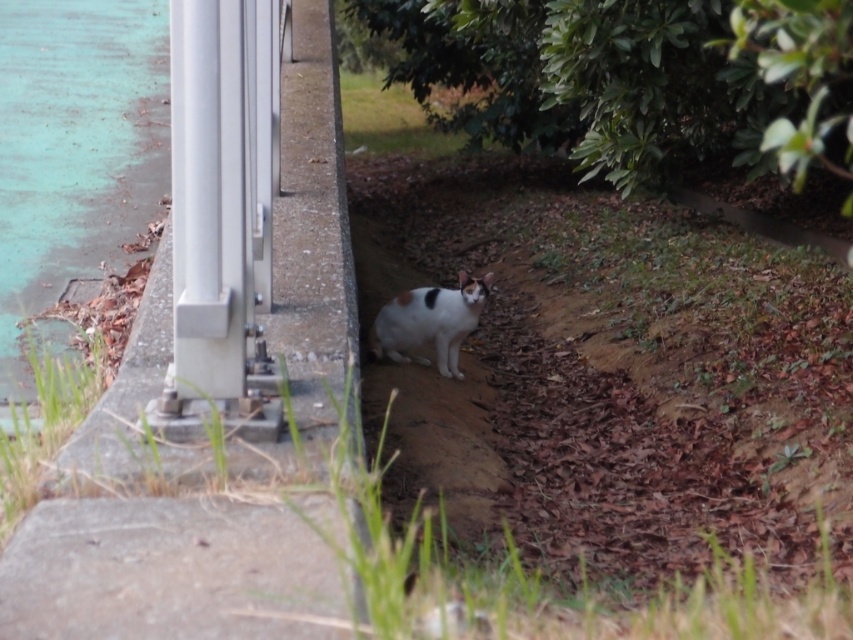
You are a photographer adjusting your camera settings to focus on two points in the image. The first point is at coordinates point (306, 12) and the second is at point (207, 45). Which point should you focus on first if you want to ensure the closest object is in sharp focus?

Point (306, 12) is further to the camera than point (207, 45), so you should focus on point (306, 12) first to capture the closest object in sharp focus.

You are standing at the position where the viewer is and want to place a 10 feet long ladder against the brushed metal ledge at lower left. Can you fit the ladder between the ledge and your current position?

The distance between the viewer and the brushed metal ledge at lower left is 9.82 feet, which is shorter than the ladder length of 10 feet. Therefore, the ladder cannot be placed between them as it would be too long.